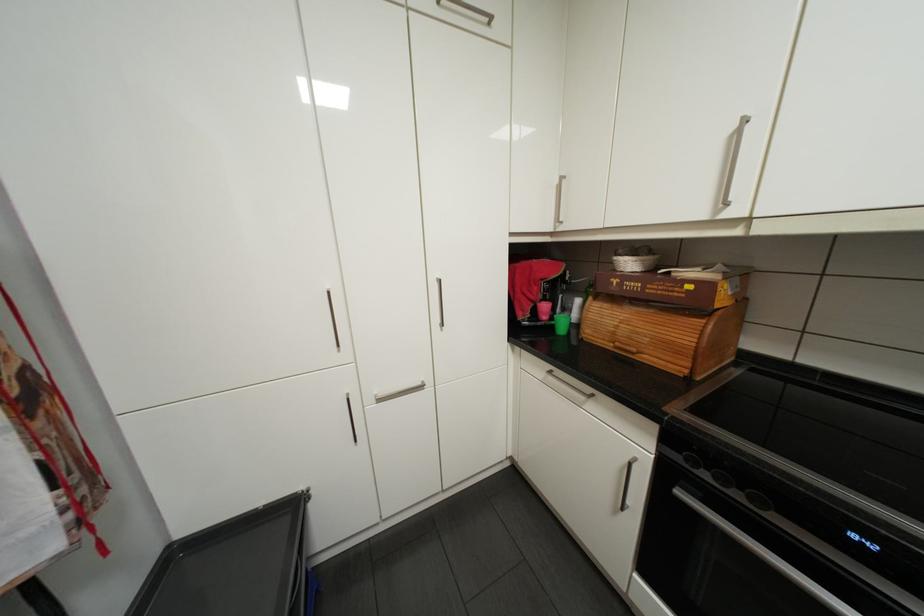
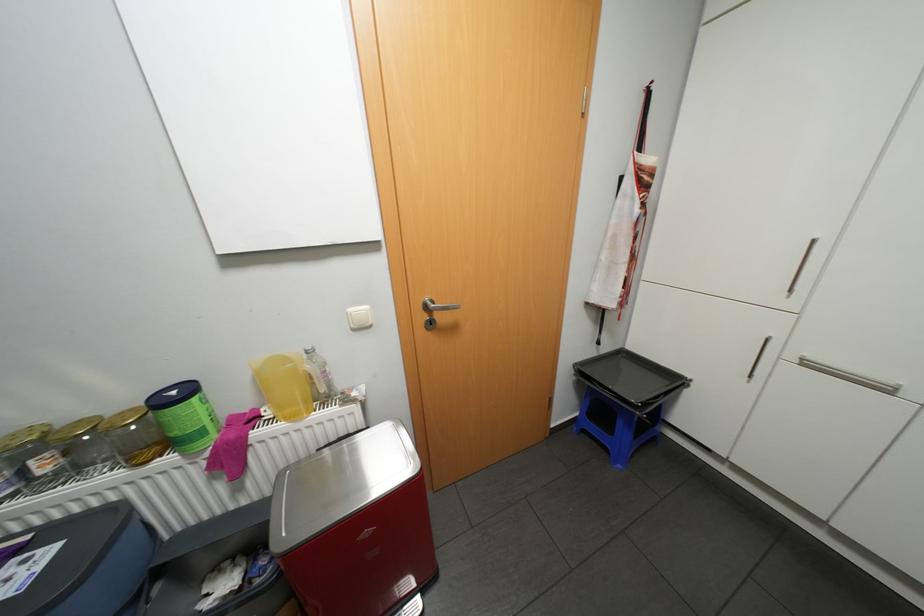
Locate, in the second image, the point that corresponds to (387,399) in the first image.

(813, 363)